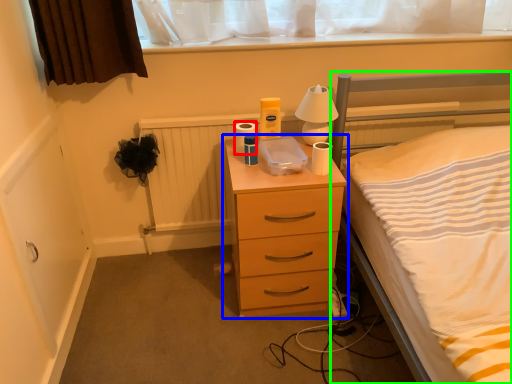
Question: Which object is the closest to the toilet paper (highlighted by a red box)? Choose among these: chest of drawers (highlighted by a blue box) or bed (highlighted by a green box).

Choices:
 (A) chest of drawers
 (B) bed

Answer: (A)